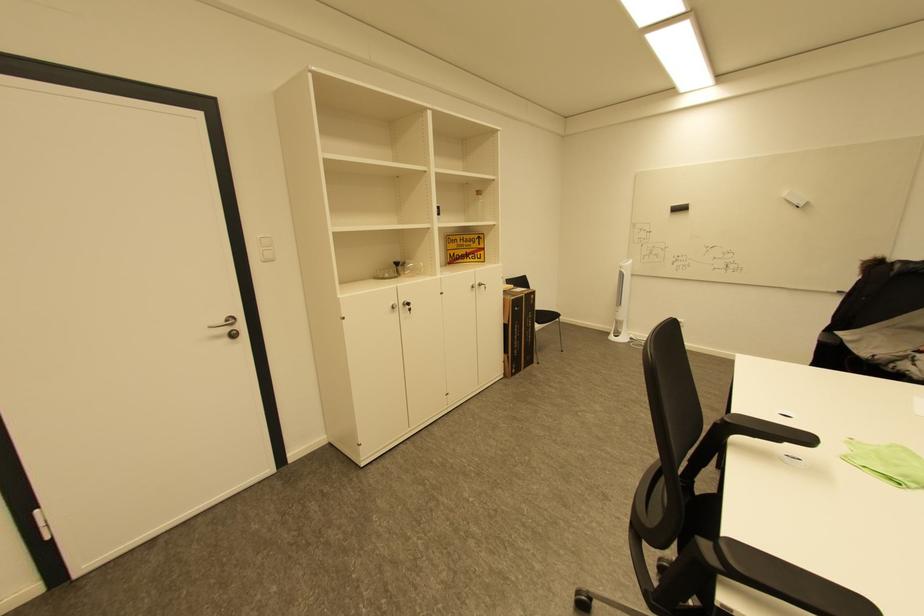
Locate an element on the screen. white light switch is located at coordinates (265, 248).